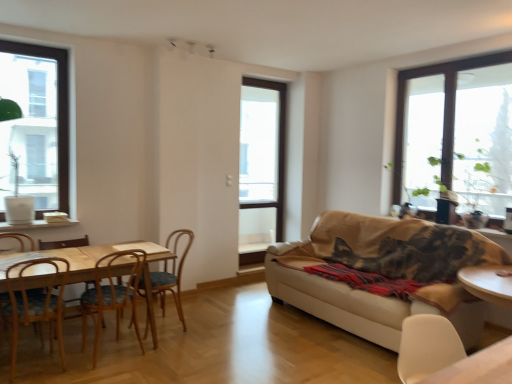
The width and height of the screenshot is (512, 384). Describe the element at coordinates (383, 273) in the screenshot. I see `beige fabric couch at lower right` at that location.

Describe the element at coordinates (426, 347) in the screenshot. I see `white matte chair at lower right, which is the fifth chair in back-to-front order` at that location.

Image resolution: width=512 pixels, height=384 pixels. Identify the location of white matte chair at lower right, which is the first chair from front to back. (426, 347).

Locate an element on the screen. white wood window sill at left is located at coordinates (36, 225).

Which object is further away from the camera, green leafy plant at right or wooden chair at left, placed as the fourth chair when sorted from right to left?

Positioned behind is green leafy plant at right.

Which object is positioned more to the left, green leafy plant at right or wooden chair at left, which ranks as the second chair in left-to-right order?

wooden chair at left, which ranks as the second chair in left-to-right order.

Which is correct: green leafy plant at right is inside wooden chair at left, positioned as the fourth chair in back-to-front order, or outside of it?

green leafy plant at right lies outside wooden chair at left, positioned as the fourth chair in back-to-front order.

Can you tell me how much green leafy plant at right and wooden chair at left, positioned as the fourth chair in back-to-front order, differ in facing direction?

89.1 degrees.

Identify the location of studio couch in front of the transparent glass window at upper right, which ranks as the 3th window in left-to-right order. The image size is (512, 384). (383, 273).

Which is more to the left, beige fabric couch at lower right or transparent glass window at upper right, acting as the 1th window starting from the right?

beige fabric couch at lower right.

Which is in front, beige fabric couch at lower right or transparent glass window at upper right, the 1th window viewed from the front?

beige fabric couch at lower right is closer to the camera.

Is beige fabric couch at lower right surrounding transparent glass window at upper right, acting as the 1th window starting from the right?

Definitely not — transparent glass window at upper right, acting as the 1th window starting from the right, is not inside beige fabric couch at lower right.

Is wooden chair at center, the 1th chair positioned from the back, at the right side of white matte chair at lower right, which is the first chair from front to back?

No.

How distant is wooden chair at center, positioned as the fourth chair in left-to-right order, from white matte chair at lower right, which is the fifth chair in back-to-front order?

8.19 feet.

Consider the image. Is wooden chair at center, the 1th chair positioned from the back, not inside white matte chair at lower right, which is the fifth chair in back-to-front order?

wooden chair at center, the 1th chair positioned from the back, is positioned outside white matte chair at lower right, which is the fifth chair in back-to-front order.

Is wooden chair at center, which is counted as the fifth chair, starting from the front, with white matte chair at lower right, the first chair positioned from the right?

wooden chair at center, which is counted as the fifth chair, starting from the front, and white matte chair at lower right, the first chair positioned from the right, are not in contact.

The image size is (512, 384). What are the coordinates of `the 4th chair positioned below the transparent glass window at upper right, which appears as the 3th window when viewed from the back (from a real-world perspective)` in the screenshot? It's located at (172, 272).

From the image's perspective, is wooden chair at center, the 1th chair positioned from the back, located above or below transparent glass window at upper right, acting as the 1th window starting from the right?

Based on their image positions, wooden chair at center, the 1th chair positioned from the back, is located beneath transparent glass window at upper right, acting as the 1th window starting from the right.

Does wooden chair at center, the 2th chair positioned from the right, turn towards transparent glass window at upper right, the 1th window viewed from the front?

No, wooden chair at center, the 2th chair positioned from the right, is not oriented towards transparent glass window at upper right, the 1th window viewed from the front.

Is white wood window sill at left taller or shorter than white matte chair at lower right, which is the first chair from front to back?

In the image, white wood window sill at left appears to be shorter than white matte chair at lower right, which is the first chair from front to back.

Are white wood window sill at left and white matte chair at lower right, the first chair positioned from the right, far apart?

Yes, white wood window sill at left is far from white matte chair at lower right, the first chair positioned from the right.

Is white wood window sill at left aimed at white matte chair at lower right, the first chair positioned from the right?

No.

Is white wood window sill at left situated inside white matte chair at lower right, the first chair positioned from the right, or outside?

white wood window sill at left is spatially situated outside white matte chair at lower right, the first chair positioned from the right.

From the image's perspective, is wooden table at left beneath clear glass window at center, which is counted as the 2th window, starting from the right?

Yes.

Is wooden table at left shorter than clear glass window at center, which is counted as the 2th window, starting from the right?

Yes.

Is wooden table at left next to clear glass window at center, the third window in the front-to-back sequence?

No, wooden table at left is not touching clear glass window at center, the third window in the front-to-back sequence.

Is wooden table at left aimed at clear glass window at center, which is counted as the 2th window, starting from the right?

No, wooden table at left does not turn towards clear glass window at center, which is counted as the 2th window, starting from the right.

From a real-world perspective, is transparent glass window at upper right, which ranks as the 3th window in left-to-right order, positioned above or below clear glass window at center, the second window from the left?

transparent glass window at upper right, which ranks as the 3th window in left-to-right order, is above clear glass window at center, the second window from the left.

Looking at this image, is transparent glass window at upper right, acting as the 1th window starting from the right, far from clear glass window at center, the 1th window in the back-to-front sequence?

transparent glass window at upper right, acting as the 1th window starting from the right, is positioned a significant distance from clear glass window at center, the 1th window in the back-to-front sequence.

Locate an element on the screen. window that is the 2nd one above the clear glass window at center, the 1th window in the back-to-front sequence (from a real-world perspective) is located at coordinates [x=455, y=133].

Does transparent glass window at upper right, the 1th window viewed from the front, turn towards clear glass window at center, the third window in the front-to-back sequence?

No, transparent glass window at upper right, the 1th window viewed from the front, is not facing towards clear glass window at center, the third window in the front-to-back sequence.

Locate an element on the screen. Image resolution: width=512 pixels, height=384 pixels. plant that is above the wooden chair at left, the second chair positioned from the front (from a real-world perspective) is located at coordinates (482, 167).

Find the location of `studio couch that is below the transparent glass window at upper right, acting as the 1th window starting from the right (from the image's perspective)`. studio couch that is below the transparent glass window at upper right, acting as the 1th window starting from the right (from the image's perspective) is located at coordinates (383, 273).

Looking at the image, which one is located closer to clear glass window at left, acting as the 1th window starting from the left, white matte chair at lower right, which is the fifth chair in left-to-right order, or transparent glass window at upper right, which appears as the 3th window when viewed from the back?

Based on the image, transparent glass window at upper right, which appears as the 3th window when viewed from the back, appears to be nearer to clear glass window at left, acting as the 1th window starting from the left.

Considering their positions, is clear glass window at center, the third window in the front-to-back sequence, positioned further to beige fabric couch at lower right than white matte chair at lower right, the first chair positioned from the right?

Among the two, clear glass window at center, the third window in the front-to-back sequence, is located further to beige fabric couch at lower right.

From the image, which object appears to be farther from woodenchair at left, the 3th chair viewed from the front, white wood window sill at left or wooden chair at left, the second chair positioned from the front?

white wood window sill at left.

Estimate the real-world distances between objects in this image. Which object is closer to woodenchair at left, the 3th chair viewed from the front, white wood window sill at left or wooden chair at center, positioned as the fourth chair in left-to-right order?

Based on the image, wooden chair at center, positioned as the fourth chair in left-to-right order, appears to be nearer to woodenchair at left, the 3th chair viewed from the front.

From the image, which object appears to be nearer to woodenchair at left, the 3th chair viewed from the front, wooden chair at left, positioned as the fourth chair in back-to-front order, or wooden table at left?

wooden table at left.

Looking at the image, which one is located further to transparent glass window at upper right, acting as the 1th window starting from the right, woodenchair at left, the third chair when ordered from right to left, or wooden chair at center, the 2th chair positioned from the right?

The object further to transparent glass window at upper right, acting as the 1th window starting from the right, is woodenchair at left, the third chair when ordered from right to left.

Looking at the image, which one is located closer to white wood window sill at left, green leafy plant at right or wooden chair at left, placed as the first chair when sorted from left to right?

The object closer to white wood window sill at left is wooden chair at left, placed as the first chair when sorted from left to right.

Looking at the image, which one is located further to clear glass window at center, the 1th window in the back-to-front sequence, wooden chair at left, the second chair positioned from the front, or wooden chair at left, positioned as the fourth chair in front-to-back order?

wooden chair at left, positioned as the fourth chair in front-to-back order, is further to clear glass window at center, the 1th window in the back-to-front sequence.

Find the location of a particular element. The width and height of the screenshot is (512, 384). plant between beige fabric couch at lower right and clear glass window at center, the 1th window in the back-to-front sequence, in the front-back direction is located at coordinates (482, 167).

At what (x,y) coordinates should I click in order to perform the action: click on plant between wooden chair at left, positioned as the fourth chair in back-to-front order, and transparent glass window at upper right, the 1th window viewed from the front, from left to right. Please return your answer as a coordinate pair (x, y). Looking at the image, I should click on [482, 167].

What are the coordinates of `kitchen & dining room table between white wood window sill at left and transparent glass window at upper right, the 1th window viewed from the front, from left to right` in the screenshot? It's located at (106, 254).

Find the location of `studio couch between woodenchair at left, which ranks as the third chair in back-to-front order, and transparent glass window at upper right, which appears as the 3th window when viewed from the back, in the horizontal direction`. studio couch between woodenchair at left, which ranks as the third chair in back-to-front order, and transparent glass window at upper right, which appears as the 3th window when viewed from the back, in the horizontal direction is located at coordinates (383, 273).